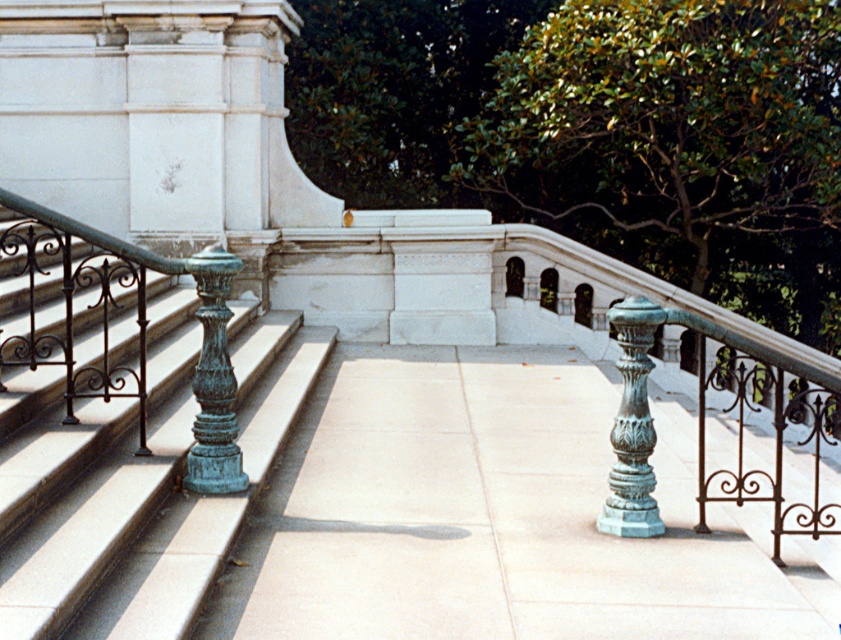
Which is behind, point (73, 390) or point (627, 486)?

The point (73, 390) is more distant.

Find the location of `green patina metal railing at left`. green patina metal railing at left is located at coordinates (119, 429).

Is point (205, 492) positioned after point (641, 301)?

Yes, point (205, 492) is farther from viewer.

From the picture: Does green patina column at center-left appear under green patina column at center?

No.

At what (x,y) coordinates should I click in order to perform the action: click on green patina column at center-left. Please return your answer as a coordinate pair (x, y). Looking at the image, I should click on (214, 381).

Can you confirm if green patina metal railing at left is positioned below green patina column at center-left?

Incorrect, green patina metal railing at left is not positioned below green patina column at center-left.

Does green patina metal railing at left have a greater width compared to green patina column at center-left?

Correct, the width of green patina metal railing at left exceeds that of green patina column at center-left.

The height and width of the screenshot is (640, 841). What do you see at coordinates (119, 429) in the screenshot? I see `green patina metal railing at left` at bounding box center [119, 429].

Identify the location of green patina metal railing at left. Image resolution: width=841 pixels, height=640 pixels. (119, 429).